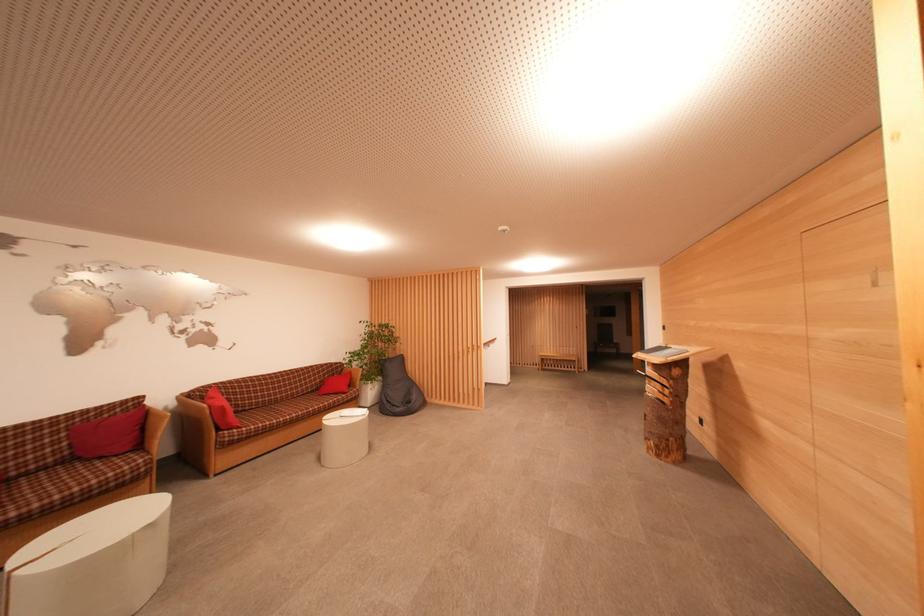
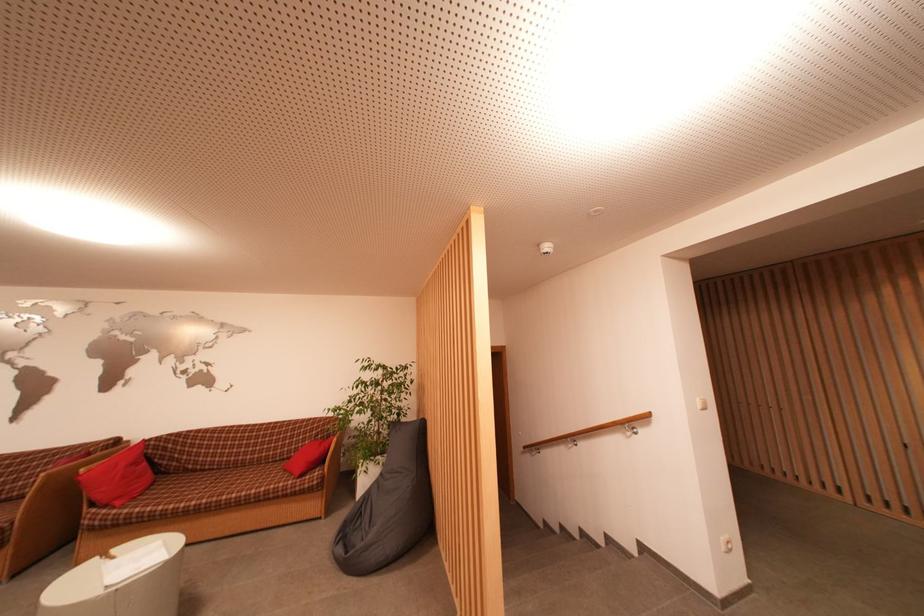
Where in the second image is the point corresponding to pixel 406 362 from the first image?

(426, 430)